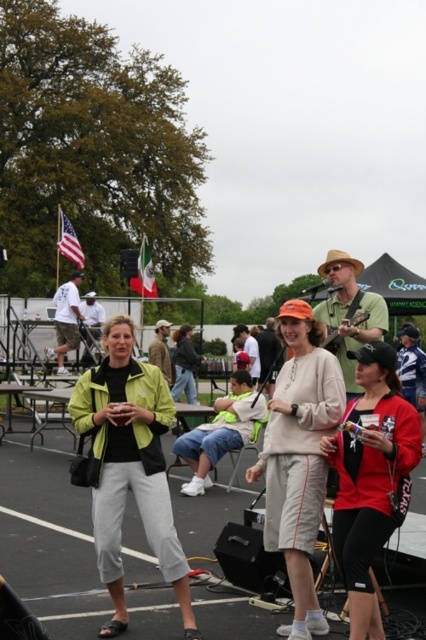
Question: Which point is farther from the camera taking this photo?

Choices:
 (A) (238, 336)
 (B) (273, 346)
 (C) (310, 534)
 (D) (144, 243)

Answer: (D)

Question: Does light beige cotton shorts at center appear over matte black baseball cap at center?

Choices:
 (A) no
 (B) yes

Answer: (B)

Question: Among these objects, which one is farthest from the camera?

Choices:
 (A) matte black jacket at center
 (B) green textured shirt at center
 (C) white t-shirt at center
 (D) matte black baseball cap at center

Answer: (A)

Question: Which point is farther from the camera taking this photo?

Choices:
 (A) (71, 280)
 (B) (95, 320)
 (C) (342, 442)
 (D) (147, 243)

Answer: (D)

Question: Where is light beige cotton shorts at center located in relation to american flag at upper left in the image?

Choices:
 (A) above
 (B) below

Answer: (B)

Question: Can you confirm if green textured shirt at center is positioned to the right of brown leather jacket at center?

Choices:
 (A) no
 (B) yes

Answer: (B)